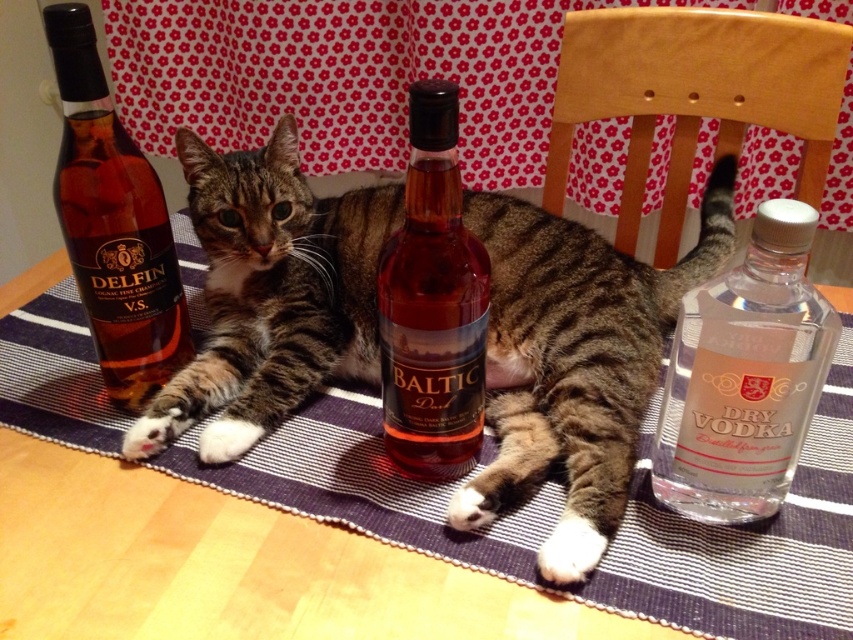
Question: Which point appears closest to the camera in this image?

Choices:
 (A) (161, 236)
 (B) (426, 346)

Answer: (B)

Question: Is clear glass bottle at right in front of translucent amber liquid at center?

Choices:
 (A) no
 (B) yes

Answer: (B)

Question: Based on their relative distances, which object is farther from the matte glass bottle at left?

Choices:
 (A) translucent amber liquid at center
 (B) tabby fur cat at center

Answer: (A)

Question: Among these objects, which one is nearest to the camera?

Choices:
 (A) translucent amber liquid at center
 (B) matte glass bottle at left

Answer: (A)

Question: Is translucent amber liquid at center smaller than matte glass bottle at left?

Choices:
 (A) no
 (B) yes

Answer: (B)

Question: Observing the image, what is the correct spatial positioning of tabby fur cat at center in reference to clear glass bottle at right?

Choices:
 (A) left
 (B) right

Answer: (A)